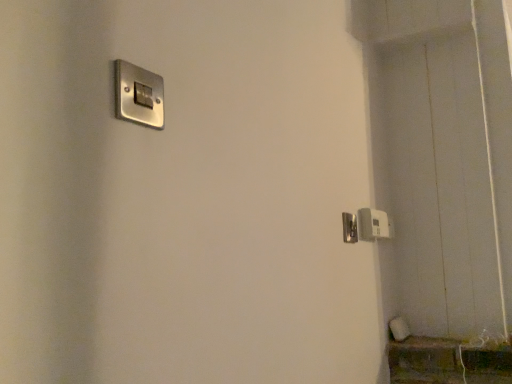
Question: Is white plastic light switch at lower right, the first light switch from the bottom, aimed at satin silver switch at upper left, positioned as the 1th light switch in front-to-back order?

Choices:
 (A) yes
 (B) no

Answer: (B)

Question: From a real-world perspective, is white plastic light switch at lower right, the 1th light switch in the right-to-left sequence, located higher than satin silver switch at upper left, which is the 2th light switch in bottom-to-top order?

Choices:
 (A) yes
 (B) no

Answer: (B)

Question: Does white plastic light switch at lower right, positioned as the second light switch in front-to-back order, have a larger size compared to satin silver switch at upper left, marked as the second light switch in a back-to-front arrangement?

Choices:
 (A) no
 (B) yes

Answer: (B)

Question: Does white plastic light switch at lower right, the 1th light switch in the right-to-left sequence, come behind satin silver switch at upper left, positioned as the second light switch in right-to-left order?

Choices:
 (A) yes
 (B) no

Answer: (A)

Question: Is white plastic light switch at lower right, arranged as the second light switch when viewed from the top, at the right side of satin silver switch at upper left, positioned as the second light switch in right-to-left order?

Choices:
 (A) yes
 (B) no

Answer: (A)

Question: Considering the relative positions of white plastic light switch at lower right, the first light switch from the bottom, and satin nickel door handle at right in the image provided, is white plastic light switch at lower right, the first light switch from the bottom, to the left or to the right of satin nickel door handle at right?

Choices:
 (A) left
 (B) right

Answer: (B)

Question: Is point (377, 228) closer or farther from the camera than point (354, 231)?

Choices:
 (A) farther
 (B) closer

Answer: (A)

Question: From their relative heights in the image, would you say white plastic light switch at lower right, positioned as the second light switch in front-to-back order, is taller or shorter than satin nickel door handle at right?

Choices:
 (A) short
 (B) tall

Answer: (B)

Question: Is white plastic light switch at lower right, the 1th light switch in the right-to-left sequence, spatially inside satin nickel door handle at right, or outside of it?

Choices:
 (A) inside
 (B) outside

Answer: (B)

Question: Considering the relative positions of satin nickel door handle at right and satin silver switch at upper left, the 1th light switch in the top-to-bottom sequence, in the image provided, is satin nickel door handle at right to the left or to the right of satin silver switch at upper left, the 1th light switch in the top-to-bottom sequence,?

Choices:
 (A) left
 (B) right

Answer: (B)

Question: From the image's perspective, is satin nickel door handle at right above or below satin silver switch at upper left, positioned as the second light switch in right-to-left order?

Choices:
 (A) above
 (B) below

Answer: (B)

Question: Relative to satin silver switch at upper left, marked as the second light switch in a back-to-front arrangement, is satin nickel door handle at right in front or behind?

Choices:
 (A) behind
 (B) front

Answer: (A)

Question: From a real-world perspective, is satin nickel door handle at right physically located above or below satin silver switch at upper left, positioned as the 1th light switch in front-to-back order?

Choices:
 (A) above
 (B) below

Answer: (B)

Question: From the image's perspective, is satin silver switch at upper left, positioned as the 1th light switch in left-to-right order, positioned above or below white plastic light switch at lower right, positioned as the second light switch in front-to-back order?

Choices:
 (A) below
 (B) above

Answer: (B)

Question: Relative to white plastic light switch at lower right, the first light switch from the bottom, is satin silver switch at upper left, positioned as the second light switch in right-to-left order, in front or behind?

Choices:
 (A) front
 (B) behind

Answer: (A)